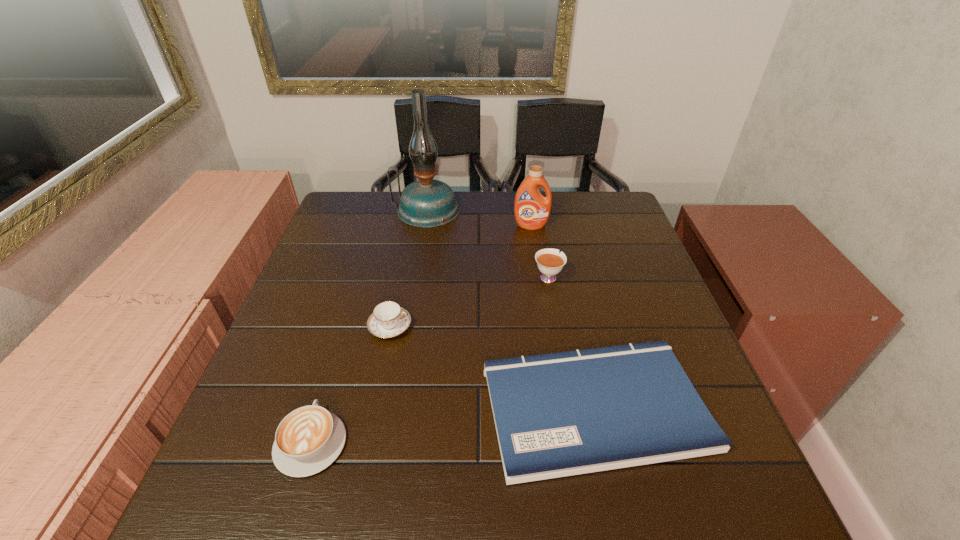
This screenshot has height=540, width=960. Identify the location of the tallest object. (426, 203).

Find the location of a particular element. The height and width of the screenshot is (540, 960). the fifth shortest object is located at coordinates (531, 210).

At what (x,y) coordinates should I click in order to perform the action: click on the farther teacup. Please return your answer as a coordinate pair (x, y). Looking at the image, I should click on (549, 261).

Locate an element on the screen. Image resolution: width=960 pixels, height=540 pixels. the fourth nearest object is located at coordinates (549, 261).

Identify the location of the left teacup. (388, 319).

Identify the location of the shorter teacup. (388, 319).

I want to click on cappuccino, so click(x=309, y=439).

Find the location of a particular element. The width and height of the screenshot is (960, 540). paperback book is located at coordinates (561, 414).

You are a GUI agent. You are given a task and a screenshot of the screen. Output one action in this format:
    pyautogui.click(x=<x>, y=<y>)
    Task: Click on the vacant space situated on the left of the tallest object
    The height and width of the screenshot is (540, 960).
    Given the screenshot: What is the action you would take?
    pyautogui.click(x=333, y=210)

Locate an element on the screen. blank area located 0.250m on the front-facing side of the fifth shortest object is located at coordinates (540, 286).